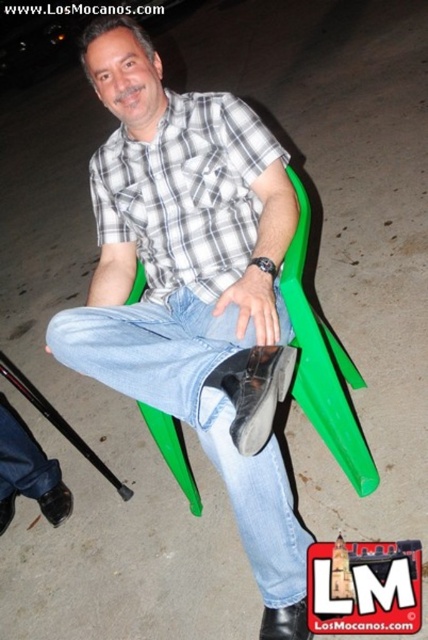
Can you confirm if matte plaid shirt at center is thinner than white checkered shirt at center?

No, matte plaid shirt at center is not thinner than white checkered shirt at center.

Identify the location of matte plaid shirt at center. The width and height of the screenshot is (428, 640). (193, 285).